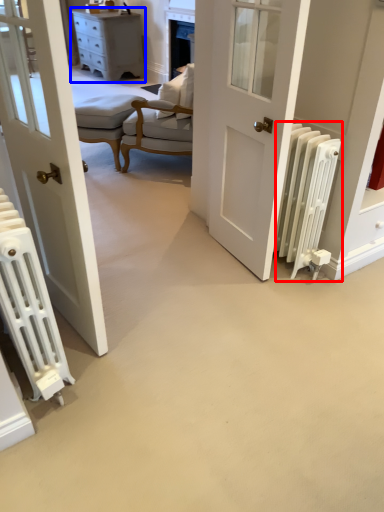
Question: Among these objects, which one is farthest to the camera, radiator (highlighted by a red box) or chest of drawers (highlighted by a blue box)?

Choices:
 (A) radiator
 (B) chest of drawers

Answer: (B)